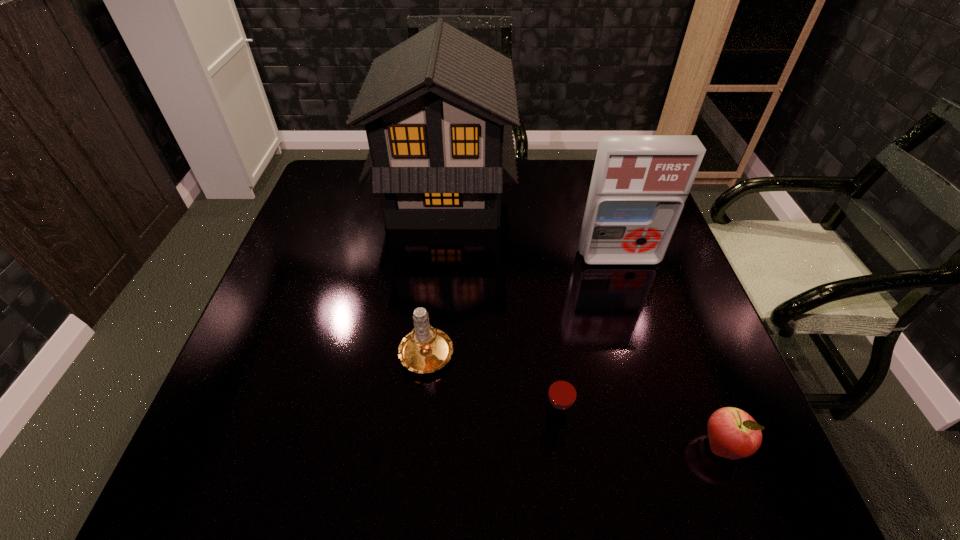
Where is `free spot between the fourth shortest object and the dollhouse`? free spot between the fourth shortest object and the dollhouse is located at coordinates (532, 226).

This screenshot has height=540, width=960. What are the coordinates of `vacant region between the first-aid kit and the candle` in the screenshot? It's located at (523, 303).

This screenshot has height=540, width=960. Find the location of `empty space between the third nearest object and the dollhouse`. empty space between the third nearest object and the dollhouse is located at coordinates (436, 272).

Select which object is the second closest to the apple. Please provide its 2D coordinates. Your answer should be formatted as a tuple, i.e. [(x, y)], where the tuple contains the x and y coordinates of a point satisfying the conditions above.

[(639, 185)]

I want to click on object that can be found as the third closest to the apple, so click(x=426, y=349).

Where is `free location that satisfies the following two spatial constraints: 1. on the front-facing side of the apple; 2. on the left side of the second farthest object`? free location that satisfies the following two spatial constraints: 1. on the front-facing side of the apple; 2. on the left side of the second farthest object is located at coordinates (679, 446).

Locate an element on the screen. free location that satisfies the following two spatial constraints: 1. on the front side of the apple; 2. on the left side of the third tallest object is located at coordinates (418, 446).

At what (x,y) coordinates should I click in order to perform the action: click on free space that satisfies the following two spatial constraints: 1. on the front side of the third nearest object; 2. on the left side of the apple. Please return your answer as a coordinate pair (x, y). The image size is (960, 540). Looking at the image, I should click on (418, 446).

Locate an element on the screen. This screenshot has height=540, width=960. free location that satisfies the following two spatial constraints: 1. on the front-facing side of the dollhouse; 2. on the left side of the apple is located at coordinates (421, 446).

This screenshot has width=960, height=540. I want to click on vacant region that satisfies the following two spatial constraints: 1. on the front-facing side of the farthest object; 2. on the back side of the glass, so click(424, 420).